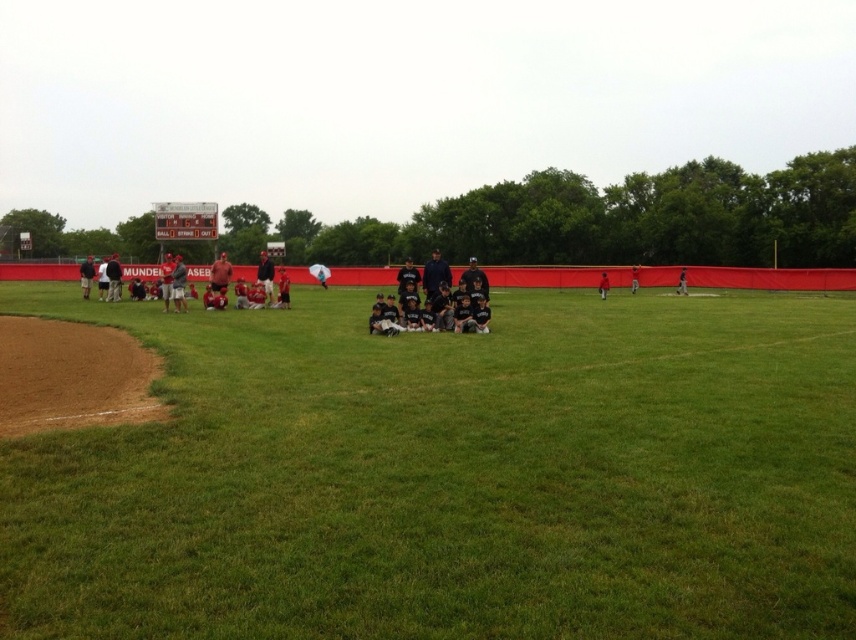
Which is in front, point (129, 572) or point (477, 282)?

Point (129, 572) is in front.

You are a GUI agent. You are given a task and a screenshot of the screen. Output one action in this format:
    pyautogui.click(x=<x>, y=<y>)
    Task: Click on the green grass at center
    This screenshot has height=640, width=856.
    Given the screenshot: What is the action you would take?
    pyautogui.click(x=450, y=476)

Looking at this image, between green grass at center and blue fabric jacket at center, which one has more height?

Standing taller between the two is blue fabric jacket at center.

Between point (452, 422) and point (429, 259), which one is positioned behind?

The point (429, 259) is behind.

Locate an element on the screen. green grass at center is located at coordinates (450, 476).

Is black jersey baseball team at center to the right of blue fabric jacket at center from the viewer's perspective?

Yes, black jersey baseball team at center is to the right of blue fabric jacket at center.

Who is positioned more to the right, black jersey baseball team at center or blue fabric jacket at center?

black jersey baseball team at center is more to the right.

Identify the location of black jersey baseball team at center. (455, 296).